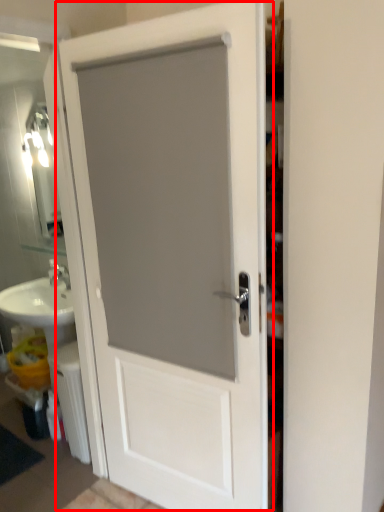
Question: From the image's perspective, what is the correct spatial positioning of door (annotated by the red box) in reference to radiator?

Choices:
 (A) above
 (B) below

Answer: (A)